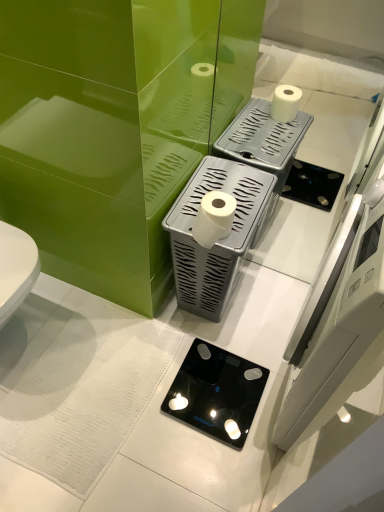
Where is `free space above white plastic toilet paper holder at center, the first appliance viewed from the top (from a real-world perspective)`? The width and height of the screenshot is (384, 512). free space above white plastic toilet paper holder at center, the first appliance viewed from the top (from a real-world perspective) is located at coordinates (230, 183).